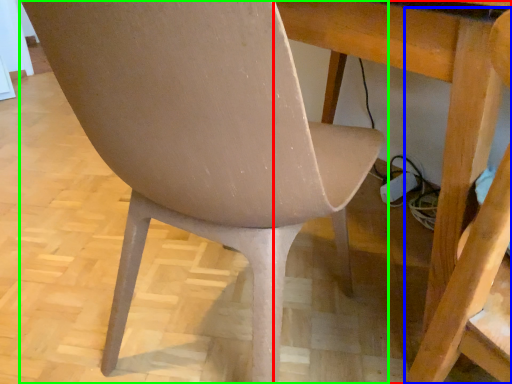
Question: Based on their relative distances, which object is farther from table (highlighted by a red box)? Choose from swivel chair (highlighted by a blue box) and chair (highlighted by a green box).

Choices:
 (A) swivel chair
 (B) chair

Answer: (B)